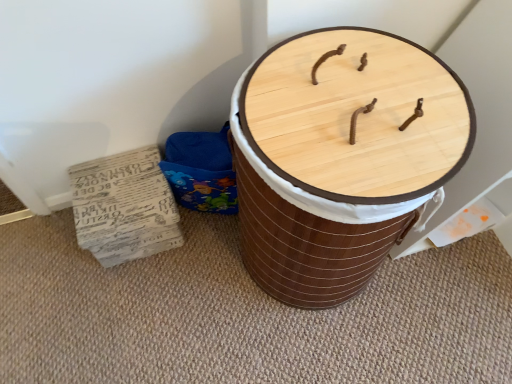
I want to click on vacant space to the right of wooden barrel at center, so click(x=457, y=291).